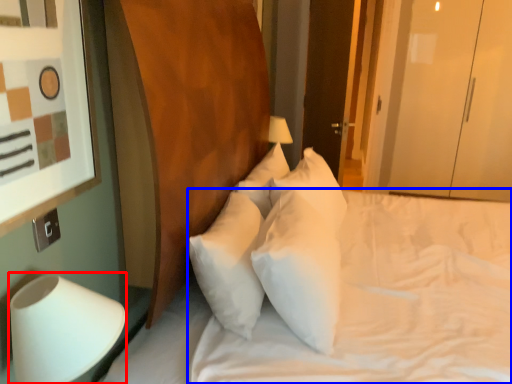
Question: Which object is further to the camera taking this photo, table lamp (highlighted by a red box) or mattress (highlighted by a blue box)?

Choices:
 (A) table lamp
 (B) mattress

Answer: (B)